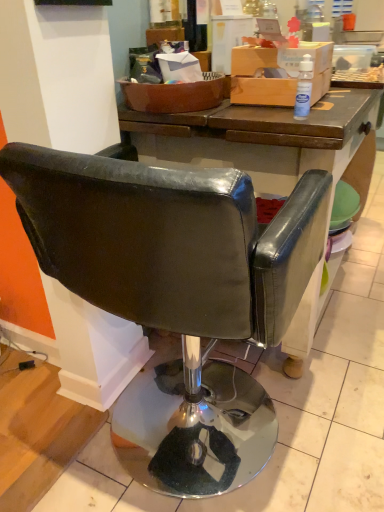
Question: Is leather-like black chair at center oriented towards transparent plastic bottle at upper right?

Choices:
 (A) yes
 (B) no

Answer: (B)

Question: Does leather-like black chair at center have a greater height compared to transparent plastic bottle at upper right?

Choices:
 (A) yes
 (B) no

Answer: (A)

Question: Can you confirm if leather-like black chair at center is bigger than transparent plastic bottle at upper right?

Choices:
 (A) no
 (B) yes

Answer: (B)

Question: From a real-world perspective, is leather-like black chair at center physically below transparent plastic bottle at upper right?

Choices:
 (A) no
 (B) yes

Answer: (B)

Question: Is transparent plastic bottle at upper right a part of leather-like black chair at center?

Choices:
 (A) yes
 (B) no

Answer: (B)

Question: Is leather-like black chair at center wider than transparent plastic bottle at upper right?

Choices:
 (A) yes
 (B) no

Answer: (A)

Question: Is leather-like black chair at center a part of transparent plastic bottle at upper right?

Choices:
 (A) yes
 (B) no

Answer: (B)

Question: Can you confirm if transparent plastic bottle at upper right is positioned to the left of leather-like black chair at center?

Choices:
 (A) yes
 (B) no

Answer: (B)

Question: Is the depth of transparent plastic bottle at upper right greater than that of leather-like black chair at center?

Choices:
 (A) yes
 (B) no

Answer: (A)

Question: From the image's perspective, does transparent plastic bottle at upper right appear lower than leather-like black chair at center?

Choices:
 (A) no
 (B) yes

Answer: (A)

Question: Can you confirm if transparent plastic bottle at upper right is bigger than leather-like black chair at center?

Choices:
 (A) yes
 (B) no

Answer: (B)

Question: From a real-world perspective, is transparent plastic bottle at upper right physically above leather-like black chair at center?

Choices:
 (A) yes
 (B) no

Answer: (A)

Question: From the image's perspective, is transparent plastic bottle at upper right positioned above or below leather-like black chair at center?

Choices:
 (A) above
 (B) below

Answer: (A)